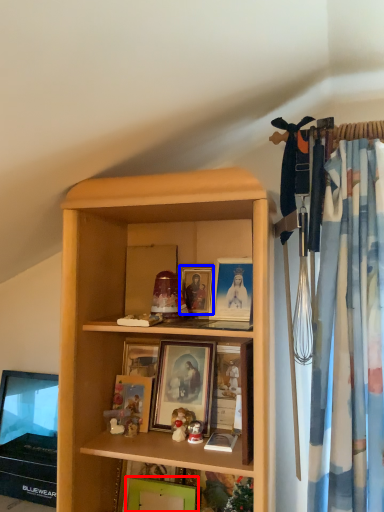
Question: Which object appears closest to the camera in this image, picture frame (highlighted by a red box) or picture frame (highlighted by a blue box)?

Choices:
 (A) picture frame
 (B) picture frame

Answer: (A)